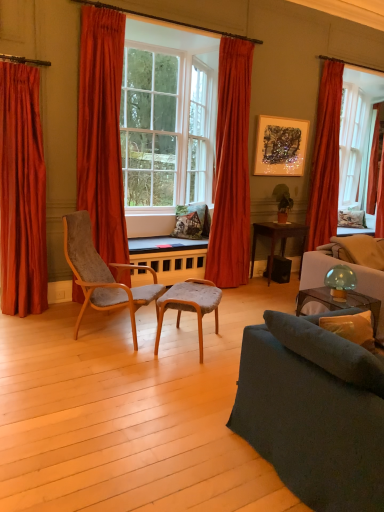
I want to click on free space in front of velvet grey chair at left, the first chair viewed from the left, so click(x=89, y=369).